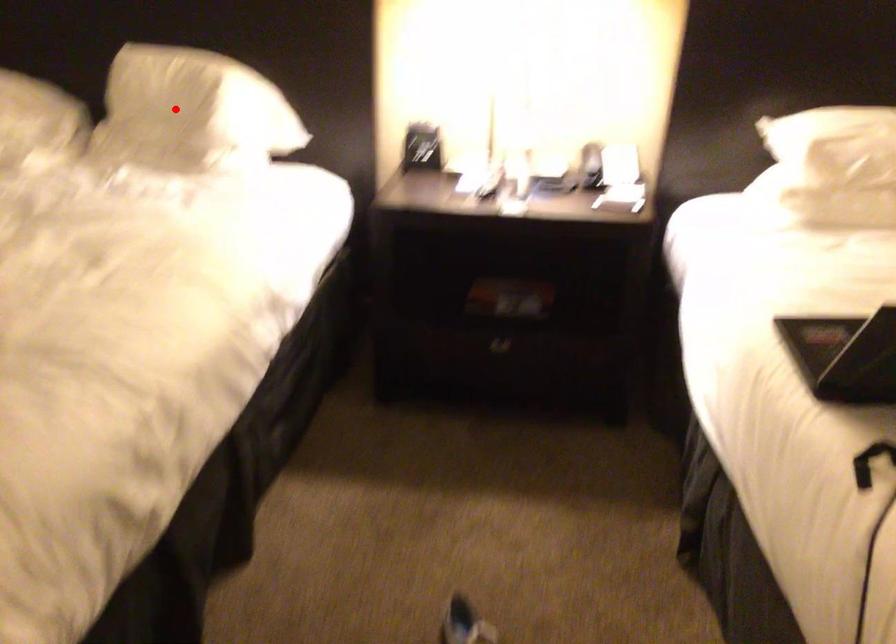
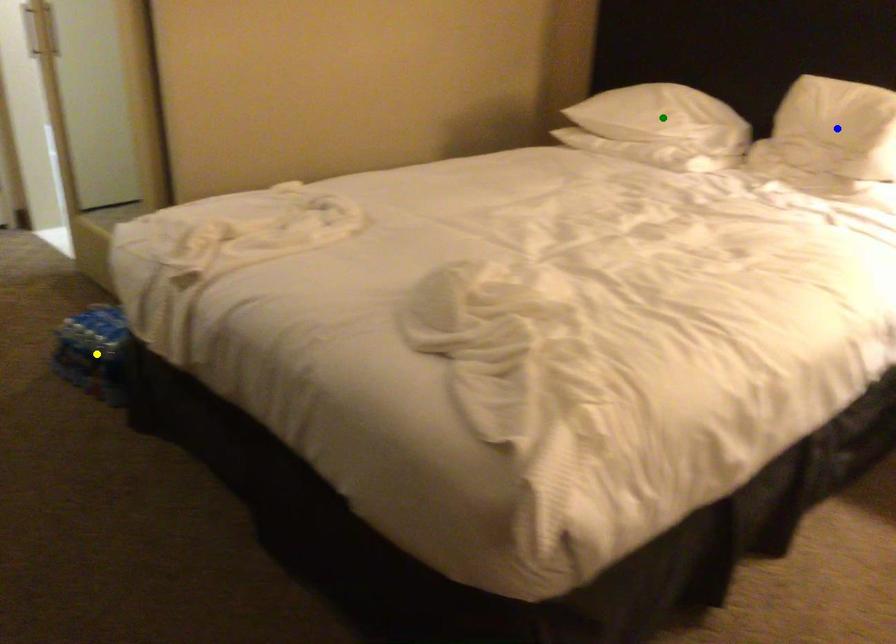
Question: I am providing you with two images of the same scene from different viewpoints. A red point is marked on the first image. You are given multiple points on the second image. Which spot in image 2 lines up with the point in image 1?

Choices:
 (A) blue point
 (B) green point
 (C) yellow point

Answer: (A)